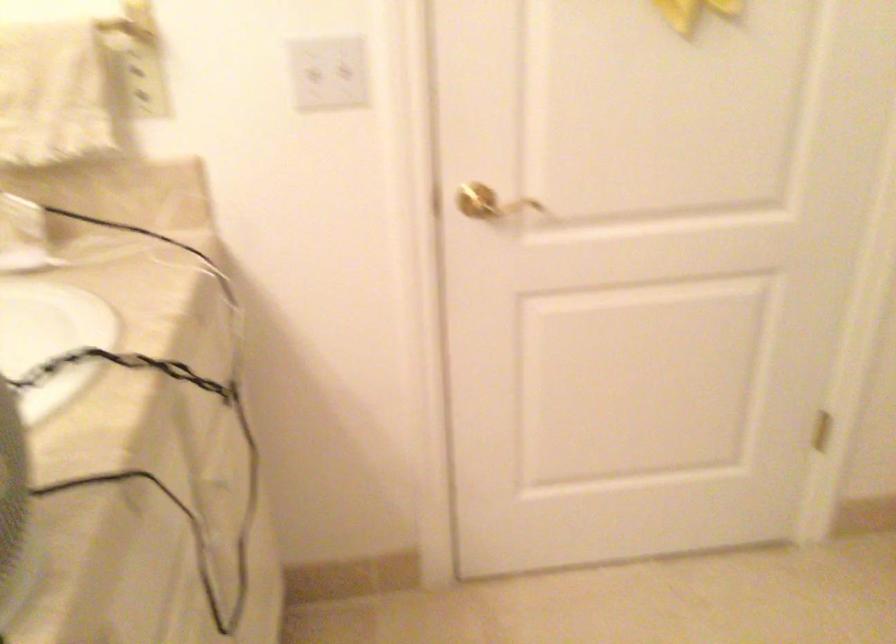
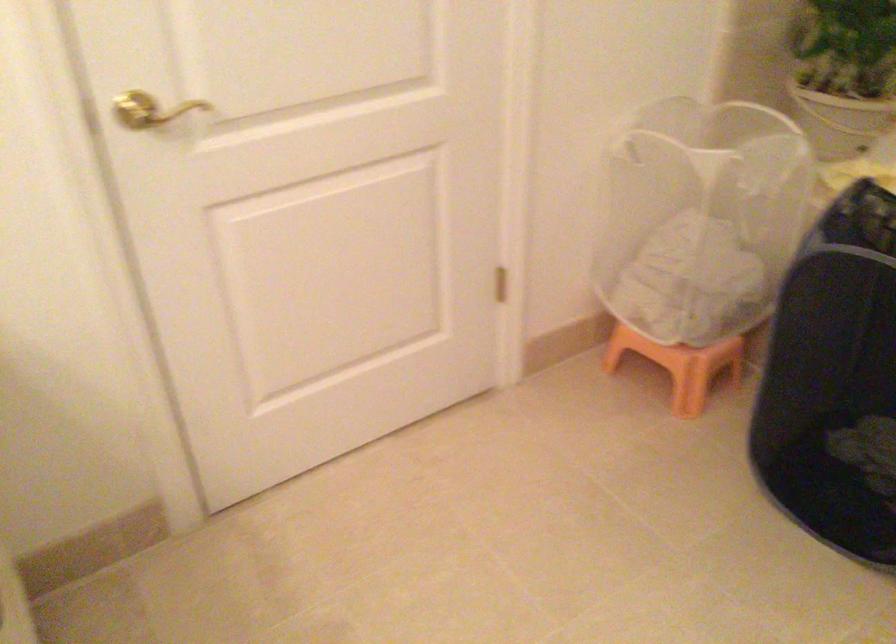
Question: Based on the continuous images, in which direction is the camera rotating? Reply with the corresponding letter.

Choices:
 (A) Left
 (B) Right
 (C) Up
 (D) Down

Answer: (B)